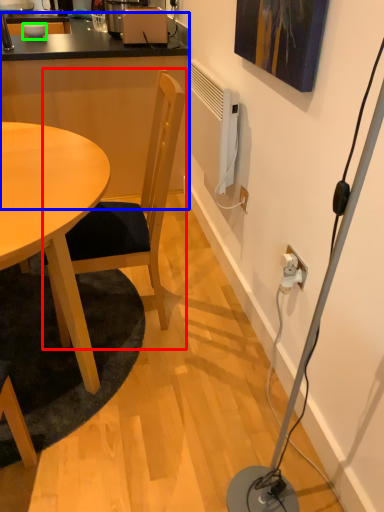
Question: Which is nearer to the chair (highlighted by a red box)? computer desk (highlighted by a blue box) or bowl (highlighted by a green box).

Choices:
 (A) computer desk
 (B) bowl

Answer: (A)